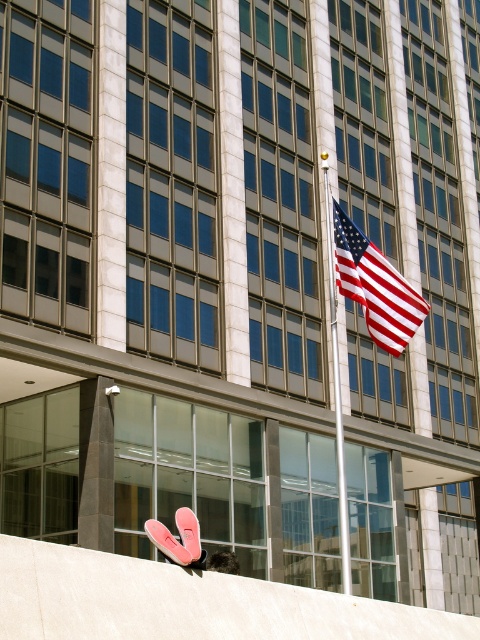
You are standing in front of the building and see the american flag at center and the white glossy flag pole at center. Which object is positioned to the right side from your perspective?

The american flag at center is positioned to the right of the white glossy flag pole at center.

You are standing at the base of the flagpole in front of the modern building. You want to place a commemorative plaque on the concrete ledge in the foreground. The plaque must be placed exactly 1 meter away from the american flag at center. Given that the flag is at coordinates point 0.447, 0.781, can you determine the coordinates where the plaque should be placed?

The plaque should be placed 1 meter away from the american flag at center. However, without knowing the scale of the coordinate system or the actual dimensions of the scene, it is impossible to determine the exact coordinates for the plaque placement based solely on the provided point (374, 285).

You are standing in front of the modern building with the flagpole. There is a concrete ledge in front of you. Where is the point located at coordinate (374,285) in relation to the American flag displayed on the flagpole?

The point at coordinate (374,285) indicates the location of the American flag at center.